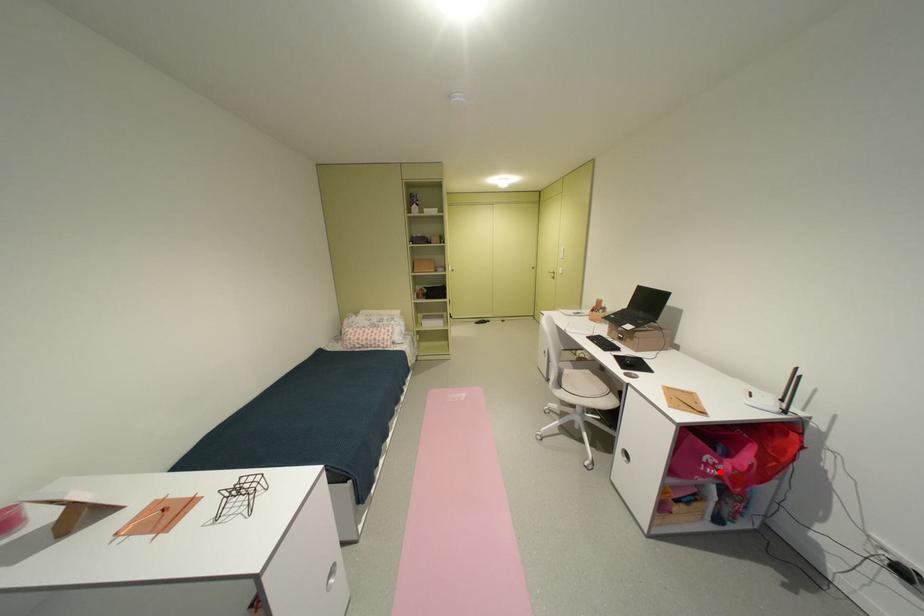
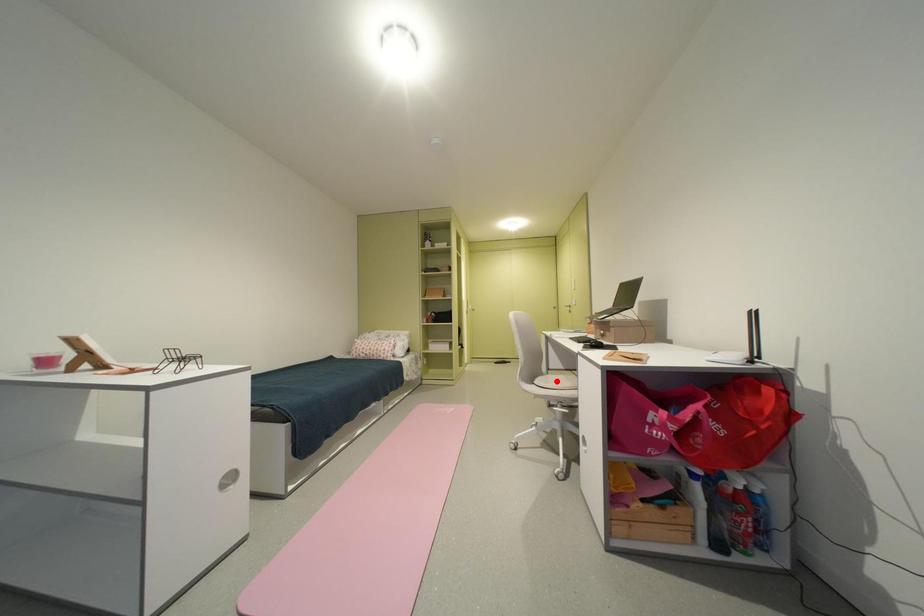
Looking at this image, I am providing you with two images of the same scene from different viewpoints. A red point is marked on the first image and another point is marked on the second image. Is the marked point in image1 the same physical position as the marked point in image2?

No